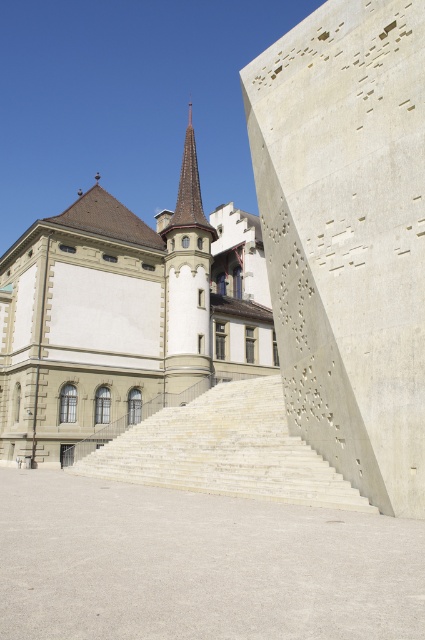
Question: Estimate the real-world distances between objects in this image. Which object is closer to the white stone building at center?

Choices:
 (A) white stone stairs at center
 (B) gray concrete stairs at lower center

Answer: (A)

Question: Which point appears closest to the camera in this image?

Choices:
 (A) (337, 568)
 (B) (169, 481)

Answer: (A)

Question: Is gray concrete stairs at lower center smaller than white stone building at center?

Choices:
 (A) yes
 (B) no

Answer: (A)

Question: Which point is closer to the camera?

Choices:
 (A) white stone stairs at center
 (B) white stone building at center
 (C) gray concrete stairs at lower center

Answer: (C)

Question: Where is gray concrete stairs at lower center located in relation to white stone stairs at center in the image?

Choices:
 (A) below
 (B) above

Answer: (B)

Question: Is gray concrete stairs at lower center positioned in front of white stone stairs at center?

Choices:
 (A) yes
 (B) no

Answer: (A)